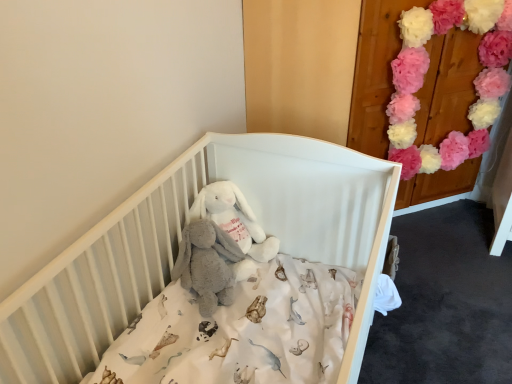
Question: Considering the positions of pink fluffy pom-poms at upper right and white plush rabbit at center in the image, is pink fluffy pom-poms at upper right wider or thinner than white plush rabbit at center?

Choices:
 (A) thin
 (B) wide

Answer: (A)

Question: From a real-world perspective, is pink fluffy pom-poms at upper right physically located above or below white plush rabbit at center?

Choices:
 (A) above
 (B) below

Answer: (A)

Question: Which object is positioned farthest from the pink fluffy pom-poms at upper right?

Choices:
 (A) white plush rabbit at center
 (B) soft gray plush at center
 (C) white matte crib at center

Answer: (B)

Question: Which of these objects is positioned farthest from the soft gray plush at center?

Choices:
 (A) white plush rabbit at center
 (B) white matte crib at center
 (C) pink fluffy pom-poms at upper right

Answer: (C)